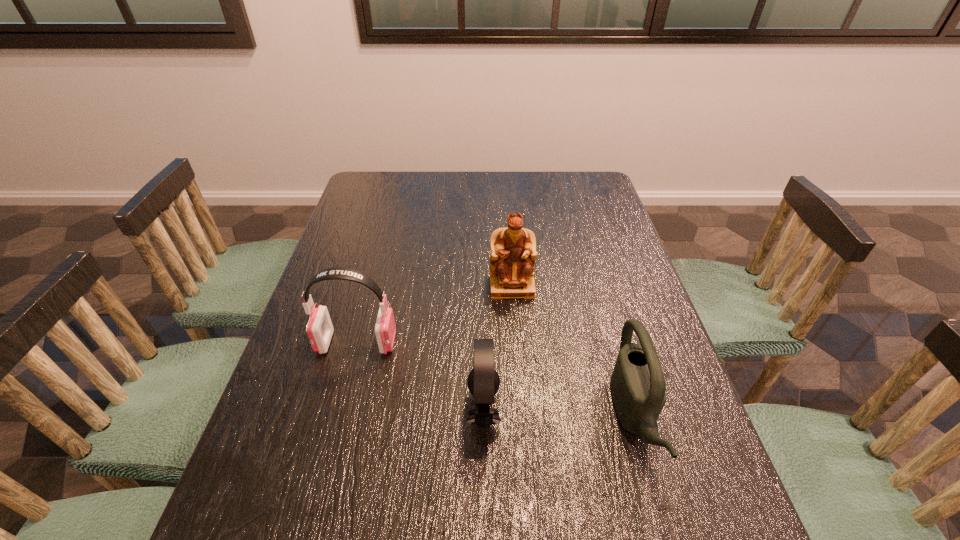
Locate an element on the screen. vacant space at the far right corner of the desktop is located at coordinates (600, 206).

Locate an element on the screen. This screenshot has height=540, width=960. free space between the rightmost object and the figurine is located at coordinates (573, 352).

Find the location of `free space between the taller earphone and the shorter earphone`. free space between the taller earphone and the shorter earphone is located at coordinates (420, 376).

Image resolution: width=960 pixels, height=540 pixels. What are the coordinates of `vacant space that is in between the shorter earphone and the figurine` in the screenshot? It's located at 497,348.

Where is `free space between the nearer earphone and the watering can`? The image size is (960, 540). free space between the nearer earphone and the watering can is located at coordinates (559, 413).

At what (x,y) coordinates should I click in order to perform the action: click on empty location between the right earphone and the figurine. Please return your answer as a coordinate pair (x, y). The height and width of the screenshot is (540, 960). Looking at the image, I should click on (497, 348).

Where is `vacant space that's between the shorter earphone and the left earphone`? vacant space that's between the shorter earphone and the left earphone is located at coordinates coord(420,376).

Where is `vacant region between the rightmost object and the figurine`? This screenshot has height=540, width=960. vacant region between the rightmost object and the figurine is located at coordinates (573, 352).

Point out which object is positioned as the nearest to the shorter earphone. Please provide its 2D coordinates. Your answer should be formatted as a tuple, i.e. [(x, y)], where the tuple contains the x and y coordinates of a point satisfying the conditions above.

[(319, 329)]

Find the location of a particular element. the third closest object relative to the rightmost object is located at coordinates (319, 329).